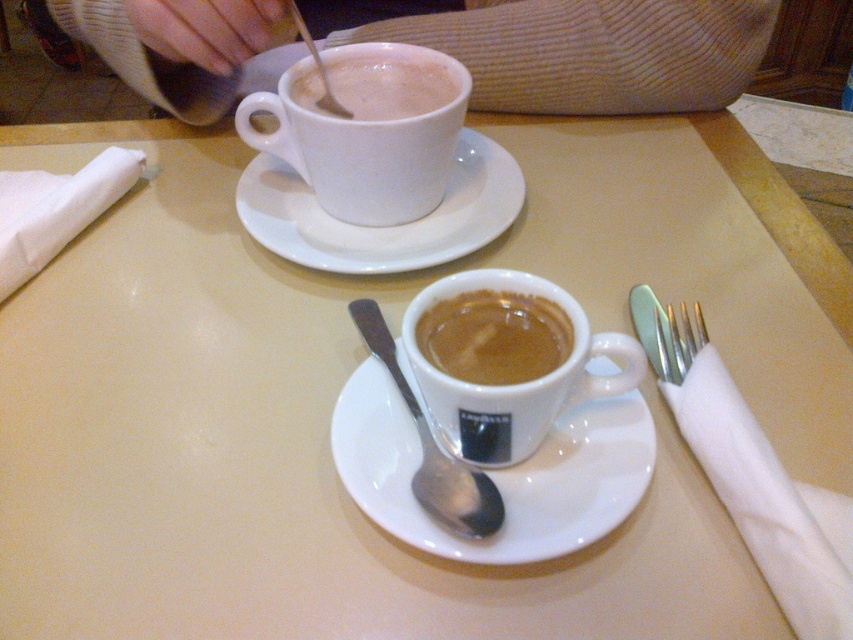
Looking at this image, you are a customer at the cafe and want to reach both items located at point (94, 12) and point (410, 65). Which point should you approach first to reach the one closer to you?

Point (410, 65) is closer to you than point (94, 12), so you should approach point (410, 65) first.

Based on the photo, you are a customer in the cafe and want to place your beige knitted sweater at upper center somewhere on the table. Based on the scene, where would be the best place to put it?

The beige knitted sweater at upper center should be placed at point [573,48] on the table.

You are a barista trying to place a 4.5 inch wide coaster between the beige knitted sweater at upper center and the matte white cup at upper center. Will the coaster fit in the space between them?

The beige knitted sweater at upper center is 6.16 inches away from the matte white cup at upper center. Since the coaster is 4.5 inches wide, there is enough space between them to fit the coaster.